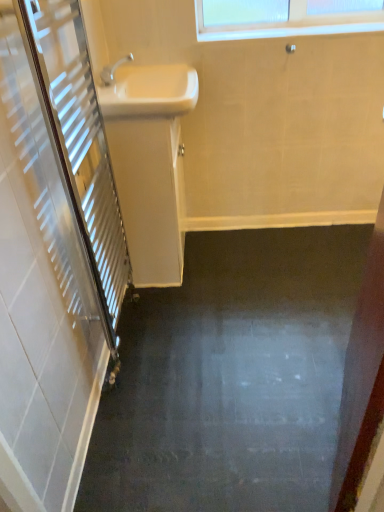
Locate an element on the screen. Image resolution: width=384 pixels, height=512 pixels. white glossy sink at upper center, which ranks as the second sink in bottom-to-top order is located at coordinates [149, 91].

What do you see at coordinates (149, 91) in the screenshot? The image size is (384, 512). I see `white glossy sink at upper center, which ranks as the second sink in bottom-to-top order` at bounding box center [149, 91].

This screenshot has height=512, width=384. What do you see at coordinates (149, 163) in the screenshot?
I see `white glossy sink at upper center, which is the second sink from top to bottom` at bounding box center [149, 163].

What is the approximate width of white glossy sink at upper center, the first sink when ordered from bottom to top?

It is 13.18 inches.

You are a GUI agent. You are given a task and a screenshot of the screen. Output one action in this format:
    pyautogui.click(x=<x>, y=<y>)
    Task: Click on the white glossy sink at upper center, which is the second sink from top to bottom
    This screenshot has width=384, height=512.
    Given the screenshot: What is the action you would take?
    pyautogui.click(x=149, y=163)

Where is `white glossy sink at upper center, which is the 1th sink in top-to-bottom order`? This screenshot has height=512, width=384. white glossy sink at upper center, which is the 1th sink in top-to-bottom order is located at coordinates 149,91.

Based on the photo, in the image, is white glossy sink at upper center, which is the 1th sink in top-to-bottom order, on the left side or the right side of white glossy sink at upper center, which is the second sink from top to bottom?

Clearly, white glossy sink at upper center, which is the 1th sink in top-to-bottom order, is on the right of white glossy sink at upper center, which is the second sink from top to bottom, in the image.

Which is in front, white glossy sink at upper center, which is the 1th sink in top-to-bottom order, or white glossy sink at upper center, which is the second sink from top to bottom?

white glossy sink at upper center, which is the 1th sink in top-to-bottom order, is closer to the camera.

Is point (145, 90) positioned in front of point (159, 245)?

Yes, it is in front of point (159, 245).

From the image's perspective, relative to white glossy sink at upper center, the first sink when ordered from bottom to top, is white glossy sink at upper center, which ranks as the second sink in bottom-to-top order, above or below?

white glossy sink at upper center, which ranks as the second sink in bottom-to-top order, is situated higher than white glossy sink at upper center, the first sink when ordered from bottom to top, in the image.

From a real-world perspective, is white glossy sink at upper center, which is the 1th sink in top-to-bottom order, on white glossy sink at upper center, the first sink when ordered from bottom to top?

Yes, from a real-world perspective, white glossy sink at upper center, which is the 1th sink in top-to-bottom order, is over white glossy sink at upper center, the first sink when ordered from bottom to top

Can you confirm if white glossy sink at upper center, which ranks as the second sink in bottom-to-top order, is thinner than white glossy sink at upper center, which is the second sink from top to bottom?

No, white glossy sink at upper center, which ranks as the second sink in bottom-to-top order, is not thinner than white glossy sink at upper center, which is the second sink from top to bottom.

Does white glossy sink at upper center, which ranks as the second sink in bottom-to-top order, have a greater height compared to white glossy sink at upper center, the first sink when ordered from bottom to top?

In fact, white glossy sink at upper center, which ranks as the second sink in bottom-to-top order, may be shorter than white glossy sink at upper center, the first sink when ordered from bottom to top.

Can you confirm if white glossy sink at upper center, which ranks as the second sink in bottom-to-top order, is bigger than white glossy sink at upper center, the first sink when ordered from bottom to top?

No, white glossy sink at upper center, which ranks as the second sink in bottom-to-top order, is not bigger than white glossy sink at upper center, the first sink when ordered from bottom to top.

Would you say white glossy sink at upper center, which is the second sink from top to bottom, is part of white glossy sink at upper center, which ranks as the second sink in bottom-to-top order,'s contents?

Definitely not — white glossy sink at upper center, which is the second sink from top to bottom, is not inside white glossy sink at upper center, which ranks as the second sink in bottom-to-top order.

Is there a large distance between white glossy sink at upper center, which ranks as the second sink in bottom-to-top order, and white glossy sink at upper center, the first sink when ordered from bottom to top?

No, white glossy sink at upper center, which ranks as the second sink in bottom-to-top order, is in close proximity to white glossy sink at upper center, the first sink when ordered from bottom to top.

In the scene shown: Is white glossy sink at upper center, which is the 1th sink in top-to-bottom order, facing towards white glossy sink at upper center, the first sink when ordered from bottom to top?

No.

How different are the orientations of white glossy sink at upper center, which ranks as the second sink in bottom-to-top order, and white glossy sink at upper center, which is the second sink from top to bottom, in degrees?

white glossy sink at upper center, which ranks as the second sink in bottom-to-top order, and white glossy sink at upper center, which is the second sink from top to bottom, are facing 0.000903 degrees away from each other.

The height and width of the screenshot is (512, 384). In order to click on sink on the left of the white glossy sink at upper center, which ranks as the second sink in bottom-to-top order in this screenshot , I will do `click(149, 163)`.

Which object is positioned more to the right, white glossy sink at upper center, the first sink when ordered from bottom to top, or white glossy sink at upper center, which ranks as the second sink in bottom-to-top order?

From the viewer's perspective, white glossy sink at upper center, which ranks as the second sink in bottom-to-top order, appears more on the right side.

Does white glossy sink at upper center, which is the second sink from top to bottom, lie in front of white glossy sink at upper center, which ranks as the second sink in bottom-to-top order?

No, white glossy sink at upper center, which is the second sink from top to bottom, is behind white glossy sink at upper center, which ranks as the second sink in bottom-to-top order.

Considering the positions of point (159, 258) and point (113, 112), is point (159, 258) closer or farther from the camera than point (113, 112)?

Clearly, point (159, 258) is more distant from the camera than point (113, 112).

From the image's perspective, is white glossy sink at upper center, the first sink when ordered from bottom to top, on top of white glossy sink at upper center, which ranks as the second sink in bottom-to-top order?

No, from the image's perspective, white glossy sink at upper center, the first sink when ordered from bottom to top, is not above white glossy sink at upper center, which ranks as the second sink in bottom-to-top order.

From a real-world perspective, which object stands above the other?

In real-world perspective, white glossy sink at upper center, which is the 1th sink in top-to-bottom order, is above.

Considering the sizes of objects white glossy sink at upper center, which is the second sink from top to bottom, and white glossy sink at upper center, which ranks as the second sink in bottom-to-top order, in the image provided, who is wider, white glossy sink at upper center, which is the second sink from top to bottom, or white glossy sink at upper center, which ranks as the second sink in bottom-to-top order,?

white glossy sink at upper center, which ranks as the second sink in bottom-to-top order.

Considering the sizes of objects white glossy sink at upper center, the first sink when ordered from bottom to top, and white glossy sink at upper center, which ranks as the second sink in bottom-to-top order, in the image provided, who is shorter, white glossy sink at upper center, the first sink when ordered from bottom to top, or white glossy sink at upper center, which ranks as the second sink in bottom-to-top order,?

With less height is white glossy sink at upper center, which ranks as the second sink in bottom-to-top order.

In terms of size, does white glossy sink at upper center, which is the second sink from top to bottom, appear bigger or smaller than white glossy sink at upper center, which ranks as the second sink in bottom-to-top order?

Clearly, white glossy sink at upper center, which is the second sink from top to bottom, is larger in size than white glossy sink at upper center, which ranks as the second sink in bottom-to-top order.

Is white glossy sink at upper center, the first sink when ordered from bottom to top, positioned beyond the bounds of white glossy sink at upper center, which ranks as the second sink in bottom-to-top order?

Indeed, white glossy sink at upper center, the first sink when ordered from bottom to top, is completely outside white glossy sink at upper center, which ranks as the second sink in bottom-to-top order.

Based on the photo, is the surface of white glossy sink at upper center, which is the second sink from top to bottom, in direct contact with white glossy sink at upper center, which ranks as the second sink in bottom-to-top order?

No, white glossy sink at upper center, which is the second sink from top to bottom, is not with white glossy sink at upper center, which ranks as the second sink in bottom-to-top order.

Is white glossy sink at upper center, the first sink when ordered from bottom to top, turned away from white glossy sink at upper center, which ranks as the second sink in bottom-to-top order?

white glossy sink at upper center, the first sink when ordered from bottom to top, is not turned away from white glossy sink at upper center, which ranks as the second sink in bottom-to-top order.

From the picture: How much distance is there between white glossy sink at upper center, the first sink when ordered from bottom to top, and white glossy sink at upper center, which ranks as the second sink in bottom-to-top order?

16.54 centimeters.

This screenshot has width=384, height=512. Identify the location of sink above the white glossy sink at upper center, the first sink when ordered from bottom to top (from a real-world perspective). (149, 91).

At what (x,y) coordinates should I click in order to perform the action: click on sink in front of the white glossy sink at upper center, the first sink when ordered from bottom to top. Please return your answer as a coordinate pair (x, y). The height and width of the screenshot is (512, 384). Looking at the image, I should click on (149, 91).

The width and height of the screenshot is (384, 512). Find the location of `sink that appears below the white glossy sink at upper center, which is the 1th sink in top-to-bottom order (from a real-world perspective)`. sink that appears below the white glossy sink at upper center, which is the 1th sink in top-to-bottom order (from a real-world perspective) is located at coordinates (149, 163).